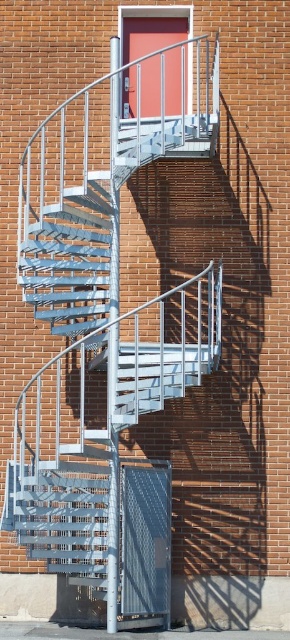
You are an architect evaluating the structural integrity of the building. You notice the metallic silver fire escape at center and the metallic silver staircase at center. Based on their heights, which one might require more reinforcement to support additional weight?

The metallic silver fire escape at center has a greater height compared to the metallic silver staircase at center, so it might require more reinforcement to support additional weight due to its increased height.

You are standing at the base of the structure and want to exit through the red door at the top. Which path should you take, the metallic silver fire escape at center or the metallic silver staircase at center, to reach the red door?

You should take the metallic silver staircase at center to reach the red door because the metallic silver fire escape at center is located to the right of it, and the red door is at the top of the staircase.

In the scene shown: You are standing at point 0.5, 0.369 in a room with a spiral staircase. There is a metallic silver fire escape at center. Is the fire escape directly in front of you or to the side?

The metallic silver fire escape at center is positioned at point (x=107, y=332), which is very close to your current position at (x=107, y=320). Therefore, the fire escape is directly in front of you.